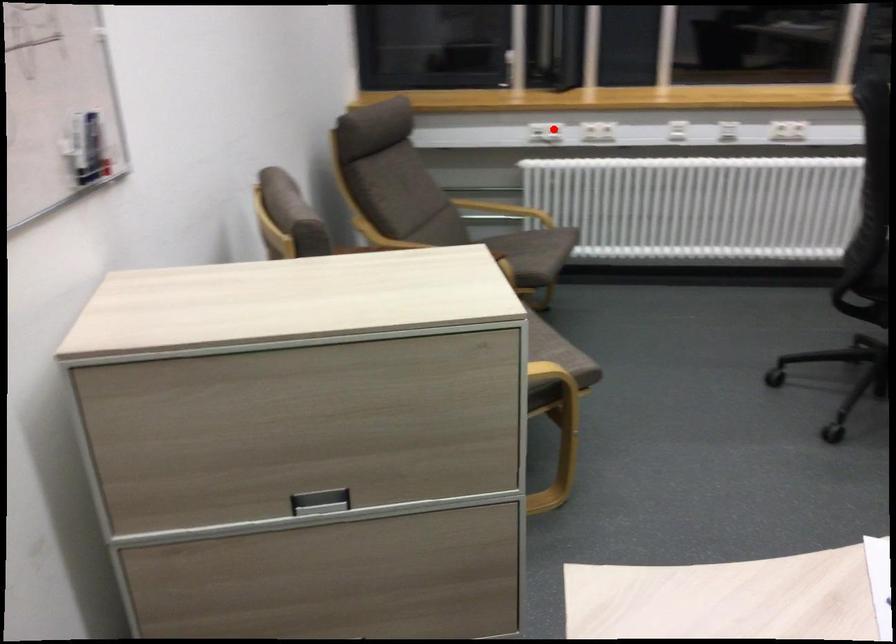
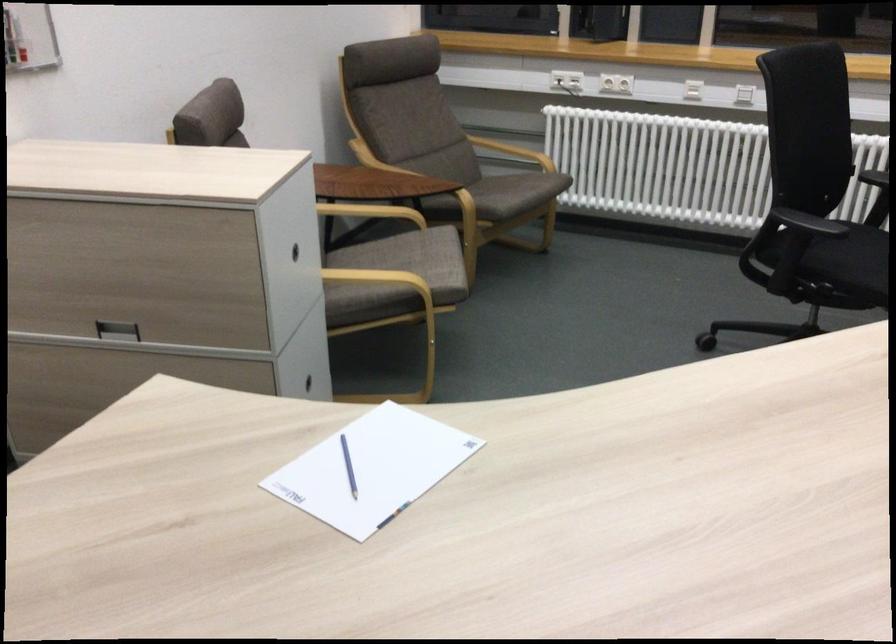
Question: I am providing you with two images of the same scene from different viewpoints. A red point is marked on the first image. Can you still see the location of the red point in image 2?

Choices:
 (A) Yes
 (B) No

Answer: (A)